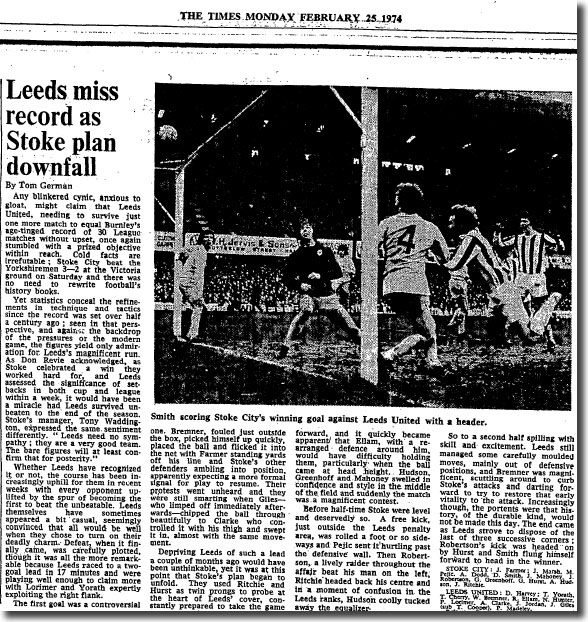
Locate an element on the screen. newspaper is located at coordinates (157, 611).